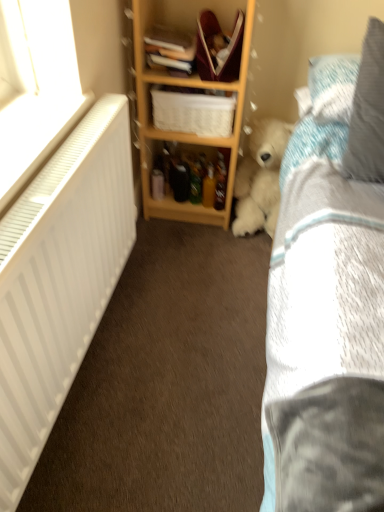
Question: From the image's perspective, is fluffy white teddy bear at lower right under hardcover book at upper center, marked as the second book in a top-to-bottom arrangement?

Choices:
 (A) yes
 (B) no

Answer: (A)

Question: Is the depth of fluffy white teddy bear at lower right less than that of hardcover book at upper center, marked as the second book in a top-to-bottom arrangement?

Choices:
 (A) yes
 (B) no

Answer: (B)

Question: Is fluffy white teddy bear at lower right beside hardcover book at upper center, the 1th book from the bottom?

Choices:
 (A) no
 (B) yes

Answer: (A)

Question: Would you consider fluffy white teddy bear at lower right to be distant from hardcover book at upper center, marked as the second book in a top-to-bottom arrangement?

Choices:
 (A) no
 (B) yes

Answer: (A)

Question: Does fluffy white teddy bear at lower right have a lesser width compared to hardcover book at upper center, marked as the second book in a top-to-bottom arrangement?

Choices:
 (A) yes
 (B) no

Answer: (B)

Question: Considering the relative sizes of fluffy white teddy bear at lower right and hardcover book at upper center, the 1th book from the bottom, in the image provided, is fluffy white teddy bear at lower right smaller than hardcover book at upper center, the 1th book from the bottom,?

Choices:
 (A) yes
 (B) no

Answer: (B)

Question: Is hardcover book at upper center, which ranks as the second book in bottom-to-top order, facing away from hardcover book at upper center, marked as the second book in a top-to-bottom arrangement?

Choices:
 (A) yes
 (B) no

Answer: (B)

Question: Is hardcover book at upper center, which ranks as the second book in bottom-to-top order, oriented towards hardcover book at upper center, marked as the second book in a top-to-bottom arrangement?

Choices:
 (A) yes
 (B) no

Answer: (B)

Question: Is hardcover book at upper center, which ranks as the second book in bottom-to-top order, wider than hardcover book at upper center, the 1th book from the bottom?

Choices:
 (A) yes
 (B) no

Answer: (B)

Question: Can you see hardcover book at upper center, the 1th book positioned from the top, touching hardcover book at upper center, the 1th book from the bottom?

Choices:
 (A) no
 (B) yes

Answer: (B)

Question: From a real-world perspective, is hardcover book at upper center, the 1th book positioned from the top, over hardcover book at upper center, the 1th book from the bottom?

Choices:
 (A) yes
 (B) no

Answer: (A)

Question: Is hardcover book at upper center, the 1th book positioned from the top, outside of hardcover book at upper center, the 1th book from the bottom?

Choices:
 (A) no
 (B) yes

Answer: (B)

Question: Considering the relative sizes of fluffy white teddy bear at lower right and blue textured pillow at upper right, which ranks as the first pillow in back-to-front order, in the image provided, is fluffy white teddy bear at lower right wider than blue textured pillow at upper right, which ranks as the first pillow in back-to-front order,?

Choices:
 (A) yes
 (B) no

Answer: (B)